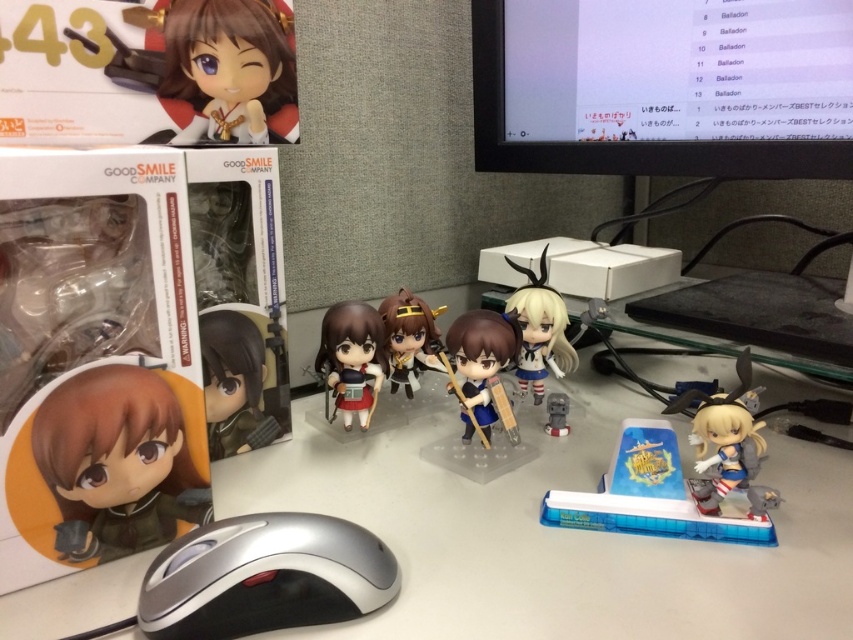
Question: Based on their relative distances, which object is nearer to the matte plastic doll at upper left?

Choices:
 (A) matte gray toy at center
 (B) matte black figurine at lower left
 (C) satin gold figurine at center

Answer: (C)

Question: Is white plastic table at center thinner than silver metallic mouse at lower center?

Choices:
 (A) no
 (B) yes

Answer: (A)

Question: Which point appears farthest from the camera in this image?

Choices:
 (A) (350, 358)
 (B) (564, 397)
 (C) (408, 384)

Answer: (C)

Question: Estimate the real-world distances between objects in this image. Which object is closer to the matte black figurine at center?

Choices:
 (A) matte black figurine at upper left
 (B) satin gold figurine at center

Answer: (B)

Question: Is matte black figurine at upper left wider than satin gold figurine at center?

Choices:
 (A) no
 (B) yes

Answer: (B)

Question: Can you confirm if matte black monitor at upper right is wider than matte black figurine at upper left?

Choices:
 (A) no
 (B) yes

Answer: (B)